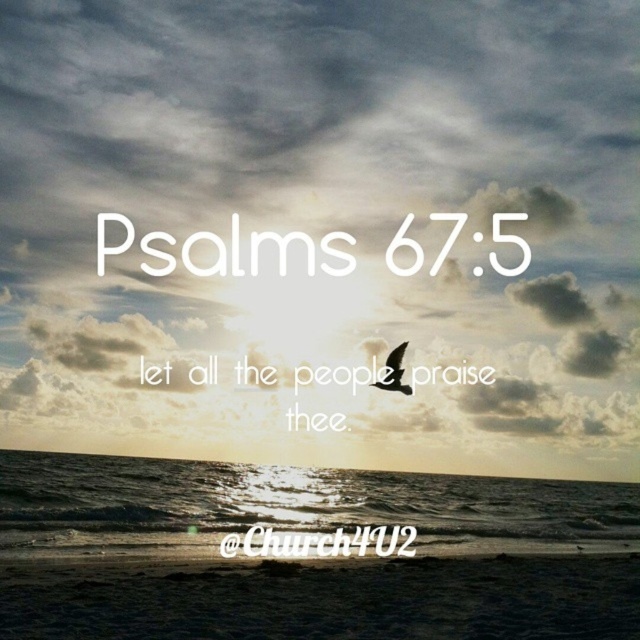
Does point (248, 19) lie behind point (317, 472)?

Yes, it is behind point (317, 472).

Who is more distant from viewer, (x=99, y=61) or (x=628, y=531)?

The point (x=99, y=61) is behind.

Between point (608, 100) and point (372, 486), which one is positioned in front?

Point (372, 486)

Where is `cloudy sky at upper center`? The width and height of the screenshot is (640, 640). cloudy sky at upper center is located at coordinates (323, 230).

Does cloudy sky at upper center appear on the right side of matte black bird at center?

In fact, cloudy sky at upper center is to the left of matte black bird at center.

Does point (177, 1) come in front of point (381, 385)?

No.

At what (x,y) coordinates should I click in order to perform the action: click on cloudy sky at upper center. Please return your answer as a coordinate pair (x, y). Looking at the image, I should click on (323, 230).

Is glistening water at lower center closer to the viewer compared to matte black bird at center?

No, it is behind matte black bird at center.

From the picture: Can you confirm if glistening water at lower center is positioned below matte black bird at center?

Yes.

The width and height of the screenshot is (640, 640). What are the coordinates of `glistening water at lower center` in the screenshot? It's located at (292, 506).

What are the coordinates of `glistening water at lower center` in the screenshot? It's located at (292, 506).